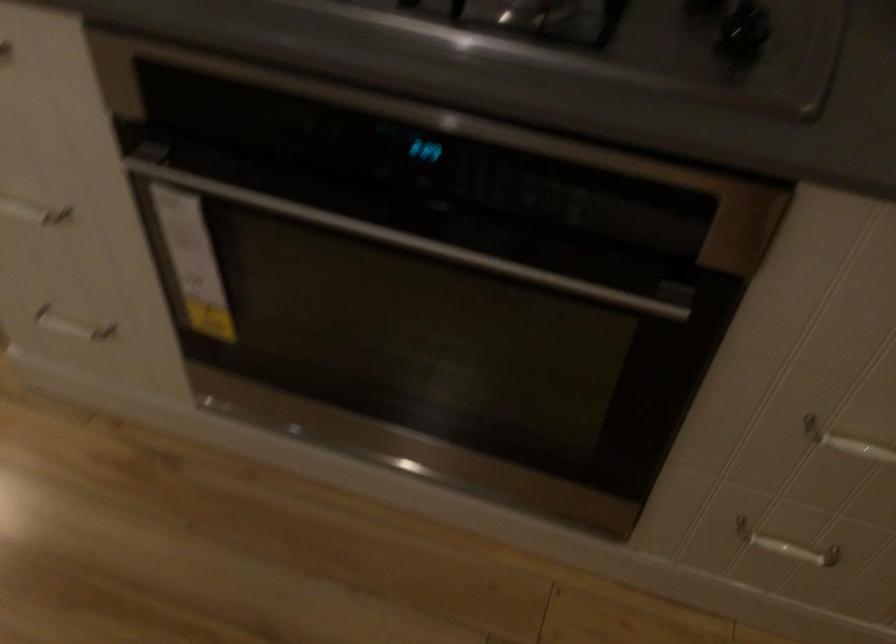
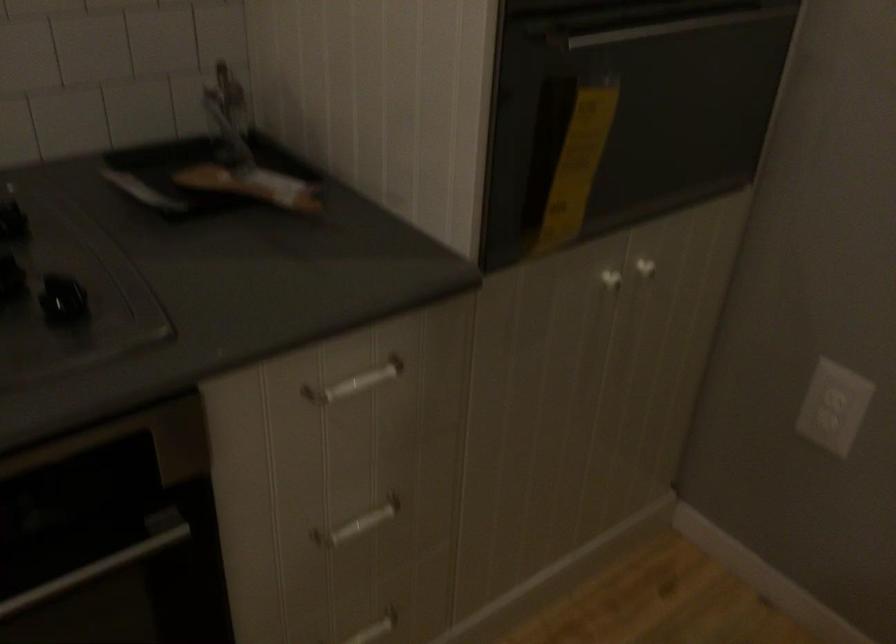
Question: I am providing you with two images of the same scene from different viewpoints. After the viewpoint changes to image2, which objects are now occluded?

Choices:
 (A) white cabinet knob
 (B) white drawer handle
 (C) metal oven handle
 (D) none of these

Answer: (D)